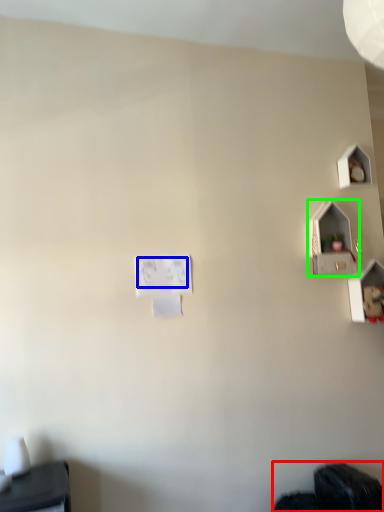
Question: Which object is the closest to the wide (highlighted by a red box)? Choose among these: writing (highlighted by a blue box) or twin (highlighted by a green box).

Choices:
 (A) writing
 (B) twin

Answer: (B)